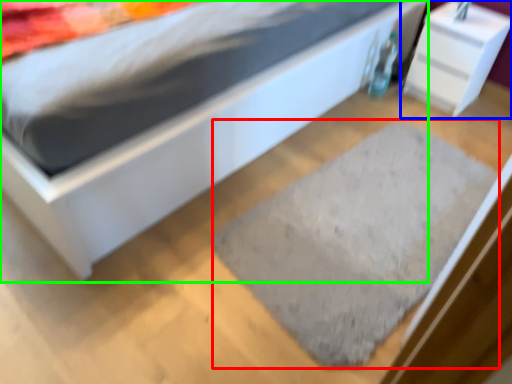
Question: Considering the real-world distances, which object is farthest from doormat (highlighted by a red box)? nightstand (highlighted by a blue box) or bed (highlighted by a green box)?

Choices:
 (A) nightstand
 (B) bed

Answer: (A)